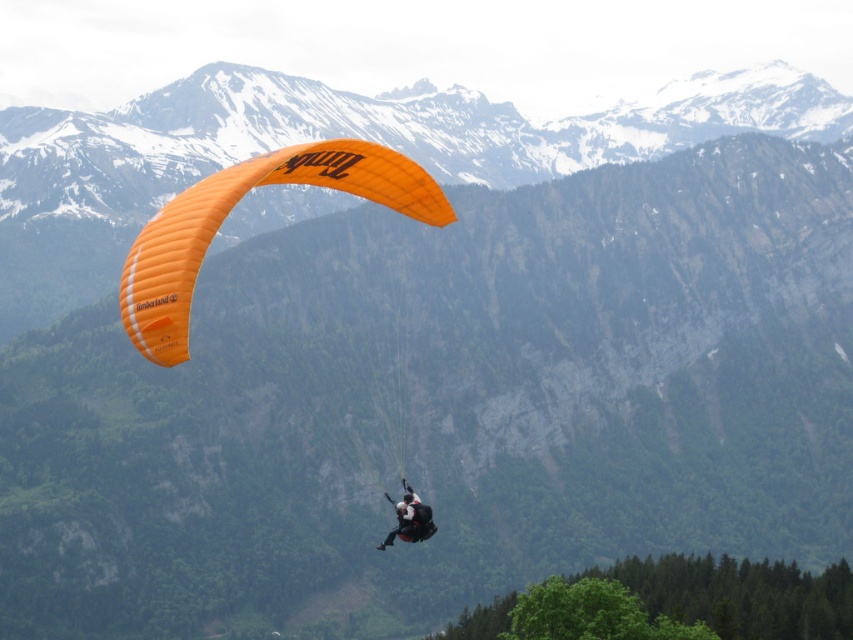
Question: Is orange fabric parachute at center to the left of black fabric parachute at center from the viewer's perspective?

Choices:
 (A) yes
 (B) no

Answer: (A)

Question: Can you confirm if orange fabric parachute at center is bigger than black fabric parachute at center?

Choices:
 (A) yes
 (B) no

Answer: (A)

Question: Among these objects, which one is farthest from the camera?

Choices:
 (A) orange fabric parachute at center
 (B) black fabric parachute at center

Answer: (B)

Question: Is orange fabric parachute at center further to the viewer compared to black fabric parachute at center?

Choices:
 (A) yes
 (B) no

Answer: (B)

Question: Which point appears farthest from the camera in this image?

Choices:
 (A) (426, 209)
 (B) (409, 502)

Answer: (A)